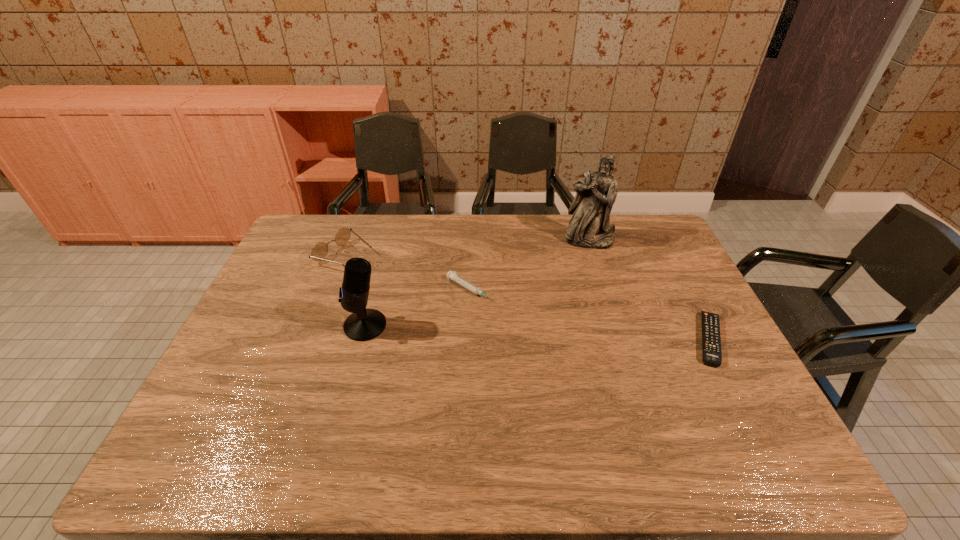
The image size is (960, 540). What are the coordinates of `free space that is in between the tallest object and the rightmost object` in the screenshot? It's located at (649, 289).

At what (x,y) coordinates should I click in order to perform the action: click on object that stands as the third closest to the third shortest object. Please return your answer as a coordinate pair (x, y). Looking at the image, I should click on (589, 227).

You are a GUI agent. You are given a task and a screenshot of the screen. Output one action in this format:
    pyautogui.click(x=<x>, y=<y>)
    Task: Click on the third closest object relative to the figurine
    The height and width of the screenshot is (540, 960).
    Given the screenshot: What is the action you would take?
    pyautogui.click(x=363, y=324)

Identify the location of blank space that satisfies the following two spatial constraints: 1. on the front side of the spectacles; 2. on the stand of the microphone. The height and width of the screenshot is (540, 960). (319, 326).

At what (x,y) coordinates should I click in order to perform the action: click on free region that satisfies the following two spatial constraints: 1. on the back side of the tallest object; 2. on the left side of the third nearest object. Please return your answer as a coordinate pair (x, y). This screenshot has width=960, height=540. Looking at the image, I should click on (471, 240).

The width and height of the screenshot is (960, 540). I want to click on free space that satisfies the following two spatial constraints: 1. on the front side of the spectacles; 2. on the stand of the fourth shortest object, so tap(319, 326).

Locate an element on the screen. free space that satisfies the following two spatial constraints: 1. on the front side of the second tallest object; 2. on the stand of the third tallest object is located at coordinates (319, 326).